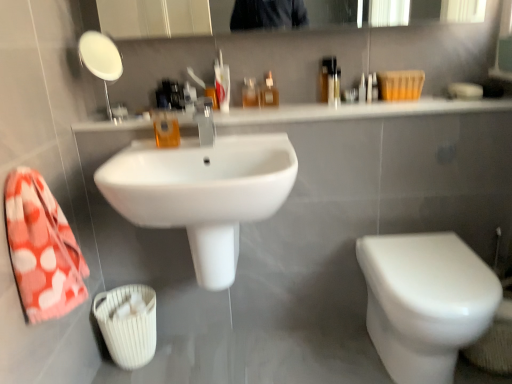
Locate an element on the screen. vacant area that is in front of translucent plastic bottle at center, acting as the first mouthwash starting from the back is located at coordinates (256, 112).